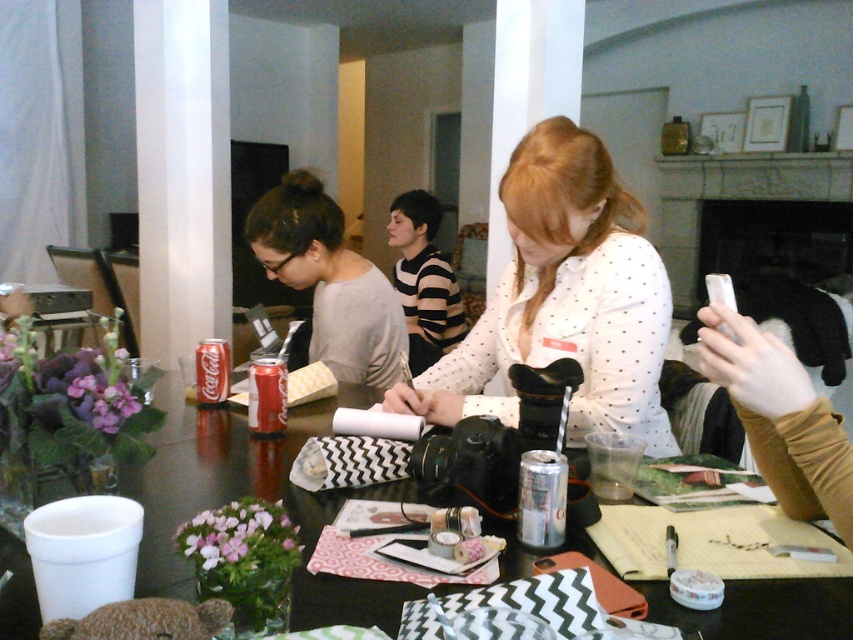
Question: Which of the following is the farthest from the observer?

Choices:
 (A) (257, 433)
 (B) (20, 595)

Answer: (A)

Question: Can you confirm if matte red can at center is smaller than coca-cola can at center?

Choices:
 (A) no
 (B) yes

Answer: (A)

Question: Where is white dotted shirt at center located in relation to matte red can at center in the image?

Choices:
 (A) right
 (B) left

Answer: (A)

Question: Which point is closer to the camera taking this photo?

Choices:
 (A) (659, 353)
 (B) (788, 609)
 (C) (196, 362)
 (D) (331, 284)

Answer: (B)

Question: Which is farther from the black glossy table at center?

Choices:
 (A) white dotted shirt at center
 (B) coca-cola can at center

Answer: (B)

Question: From the image, what is the correct spatial relationship of matte gray sweater at center in relation to coca-cola can at center?

Choices:
 (A) left
 (B) right

Answer: (B)